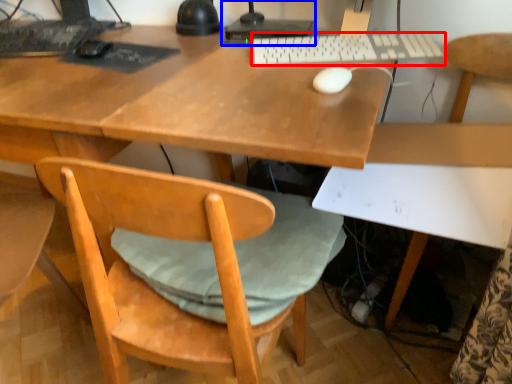
Question: Among these objects, which one is farthest to the camera, computer keyboard (highlighted by a red box) or desktop computer (highlighted by a blue box)?

Choices:
 (A) computer keyboard
 (B) desktop computer

Answer: (B)